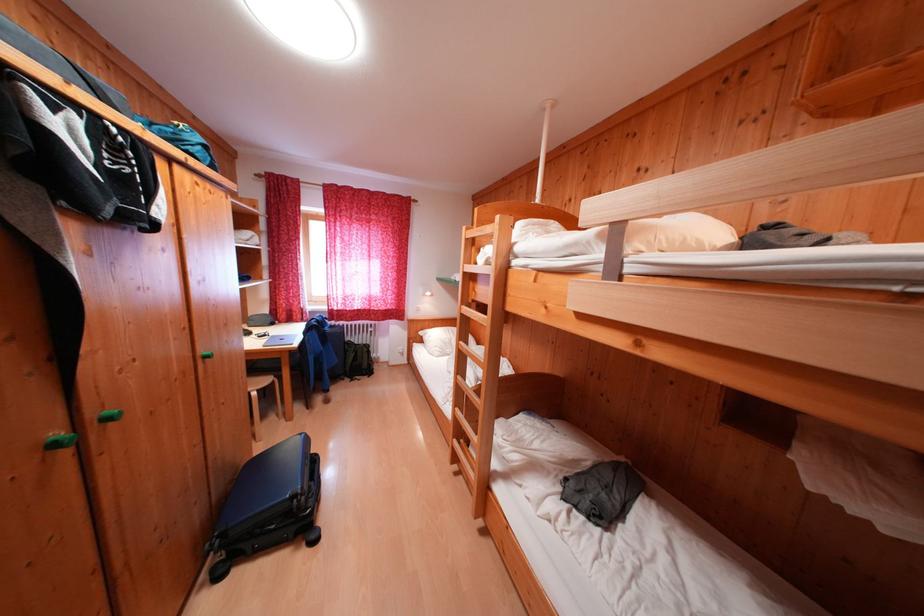
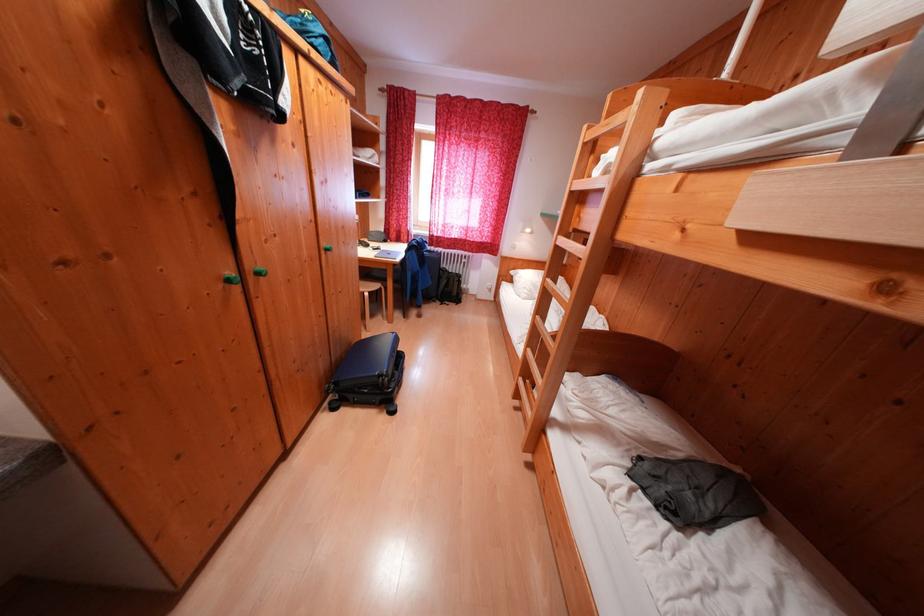
In the second image, find the point that corresponds to pixel 274 384 in the first image.

(383, 290)